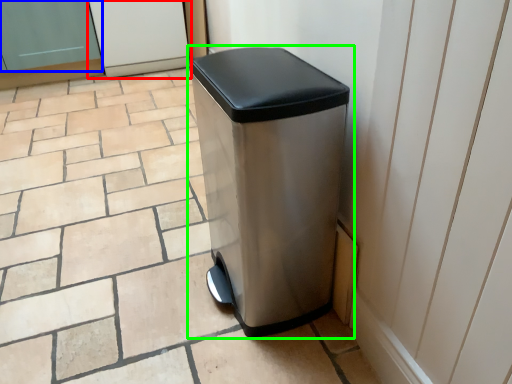
Question: Which is farther away from screen door (highlighted by a red box)? screen door (highlighted by a blue box) or waste container (highlighted by a green box)?

Choices:
 (A) screen door
 (B) waste container

Answer: (B)